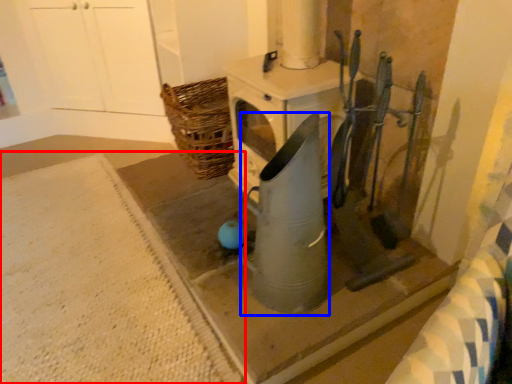
Question: Which object appears farthest to the camera in this image, concrete (highlighted by a red box) or appliance (highlighted by a blue box)?

Choices:
 (A) concrete
 (B) appliance

Answer: (A)